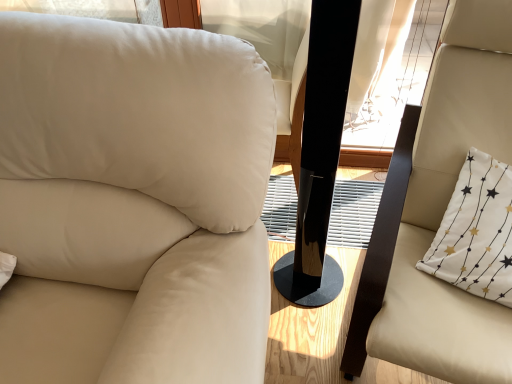
Question: Does white fabric pillow at right lie behind beige leather chair at left, which is counted as the 1th chair, starting from the left?

Choices:
 (A) no
 (B) yes

Answer: (B)

Question: Is white fabric pillow at right looking in the opposite direction of beige leather chair at left, which is counted as the 1th chair, starting from the left?

Choices:
 (A) yes
 (B) no

Answer: (B)

Question: Considering the relative positions of white fabric pillow at right and beige leather chair at left, placed as the 2th chair when sorted from right to left, in the image provided, is white fabric pillow at right in front of beige leather chair at left, placed as the 2th chair when sorted from right to left,?

Choices:
 (A) no
 (B) yes

Answer: (A)

Question: Is white fabric pillow at right oriented towards beige leather chair at left, which is counted as the 1th chair, starting from the left?

Choices:
 (A) yes
 (B) no

Answer: (B)

Question: Is white fabric pillow at right not inside beige leather chair at left, which is counted as the 1th chair, starting from the left?

Choices:
 (A) yes
 (B) no

Answer: (A)

Question: Can you confirm if white fabric pillow at right is thinner than beige leather chair at left, which is counted as the 1th chair, starting from the left?

Choices:
 (A) no
 (B) yes

Answer: (B)

Question: Does beige leather chair at right, the 1th chair viewed from the right, have a larger size compared to black glossy speaker at center?

Choices:
 (A) yes
 (B) no

Answer: (A)

Question: Is black glossy speaker at center inside beige leather chair at right, the 2th chair positioned from the left?

Choices:
 (A) no
 (B) yes

Answer: (A)

Question: From the image's perspective, would you say beige leather chair at right, the 2th chair positioned from the left, is positioned over black glossy speaker at center?

Choices:
 (A) no
 (B) yes

Answer: (A)

Question: Does beige leather chair at right, the 1th chair viewed from the right, appear on the left side of black glossy speaker at center?

Choices:
 (A) no
 (B) yes

Answer: (A)

Question: Are beige leather chair at right, the 2th chair positioned from the left, and black glossy speaker at center beside each other?

Choices:
 (A) yes
 (B) no

Answer: (B)

Question: Is beige leather chair at left, placed as the 2th chair when sorted from right to left, closer to the viewer compared to white fabric pillow at right?

Choices:
 (A) yes
 (B) no

Answer: (A)